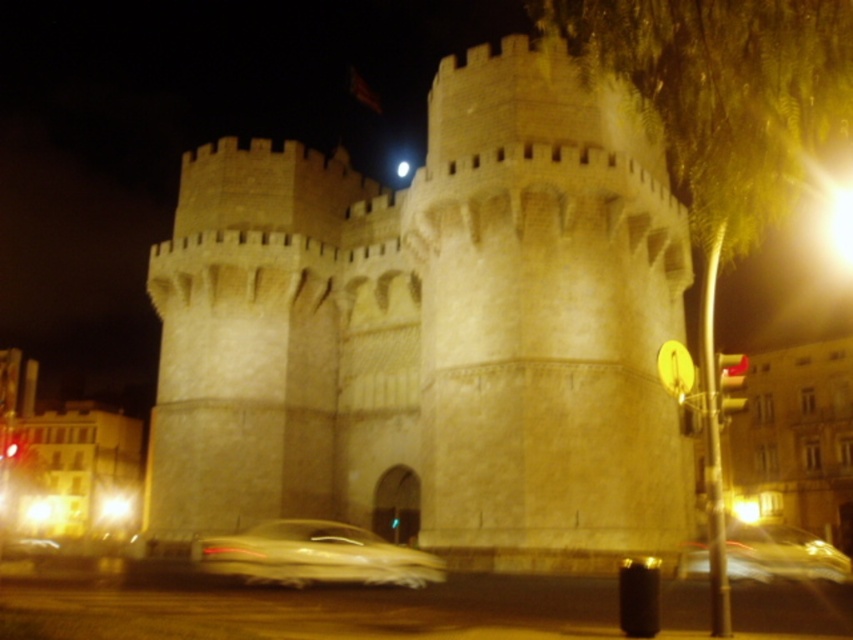
You are a photographer who wants to capture the stone castle at center and the metallic gold car at lower center in a single photo. Based on their sizes, which object should you focus on to ensure both are in frame without cropping?

The stone castle at center is taller than the metallic gold car at lower center, so focusing on the castle will ensure both are in frame without cropping.

You are a photographer who wants to take a clearer photo of the metallic gold car at lower center without the stone castle at center blocking it. What should you do?

Move closer to the metallic gold car at lower center so that it is no longer blocked by the stone castle at center, since the stone castle at center is currently closer to the viewer and obstructing the view of the car.

You are a photographer who wants to capture a photo of the stone castle at center and the metallic gold car at lower center. If you want to ensure both are fully visible in the frame, which object should you prioritize framing first?

The stone castle at center is wider than the metallic gold car at lower center. Therefore, you should prioritize framing the stone castle at center first to ensure it fits entirely within the camera frame before adjusting for the metallic gold car at lower center.